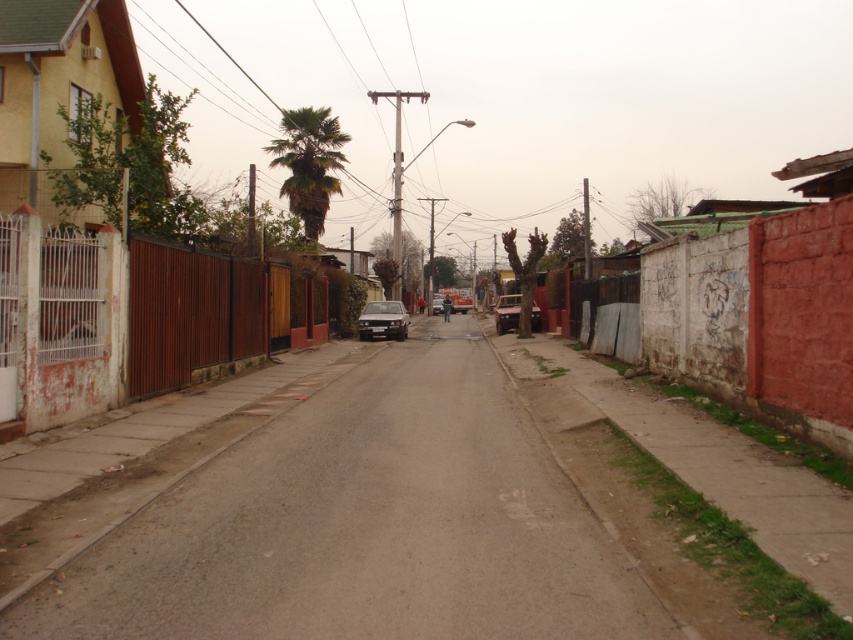
Does smooth asphalt road at center have a greater height compared to satin black car at center?

No, smooth asphalt road at center is not taller than satin black car at center.

Which is above, smooth asphalt road at center or satin black car at center?

satin black car at center is higher up.

Image resolution: width=853 pixels, height=640 pixels. What do you see at coordinates (364, 525) in the screenshot?
I see `smooth asphalt road at center` at bounding box center [364, 525].

Locate an element on the screen. The width and height of the screenshot is (853, 640). smooth asphalt road at center is located at coordinates click(x=364, y=525).

Between smooth asphalt road at center and matte black car at center, which one is positioned lower?

smooth asphalt road at center is below.

Measure the distance between point (283,429) and camera.

The distance of point (283,429) from camera is 36.08 feet.

Does point (254, 568) come behind point (500, 326)?

That is False.

Locate an element on the screen. The image size is (853, 640). smooth asphalt road at center is located at coordinates (364, 525).

Between satin black car at center and matte black car at center, which one has more height?

matte black car at center

This screenshot has height=640, width=853. I want to click on satin black car at center, so click(383, 321).

Is point (379, 310) positioned before point (500, 308)?

Yes, point (379, 310) is closer to viewer.

Image resolution: width=853 pixels, height=640 pixels. Identify the location of satin black car at center. (383, 321).